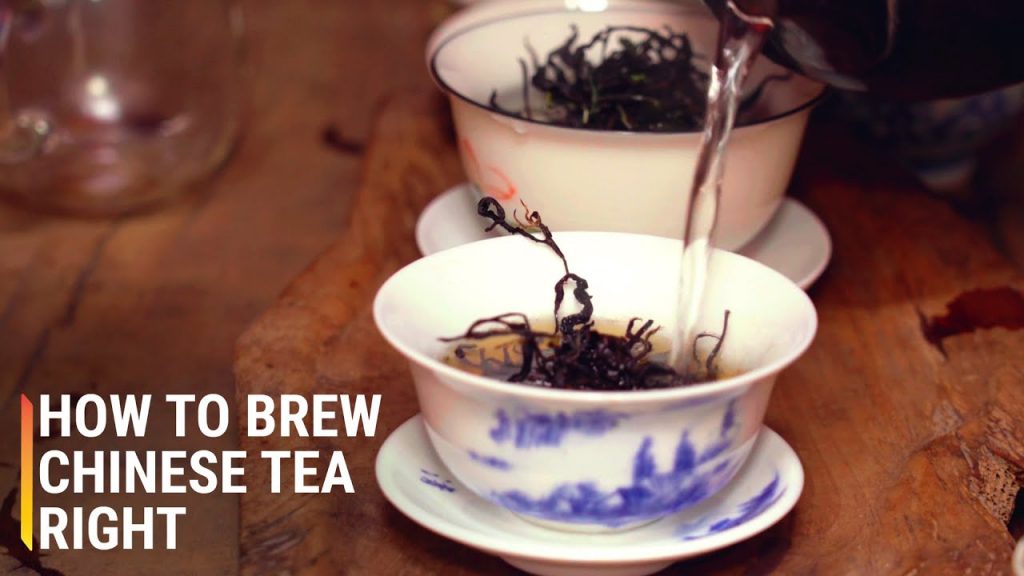
I want to click on wood grain, so click(317, 286).